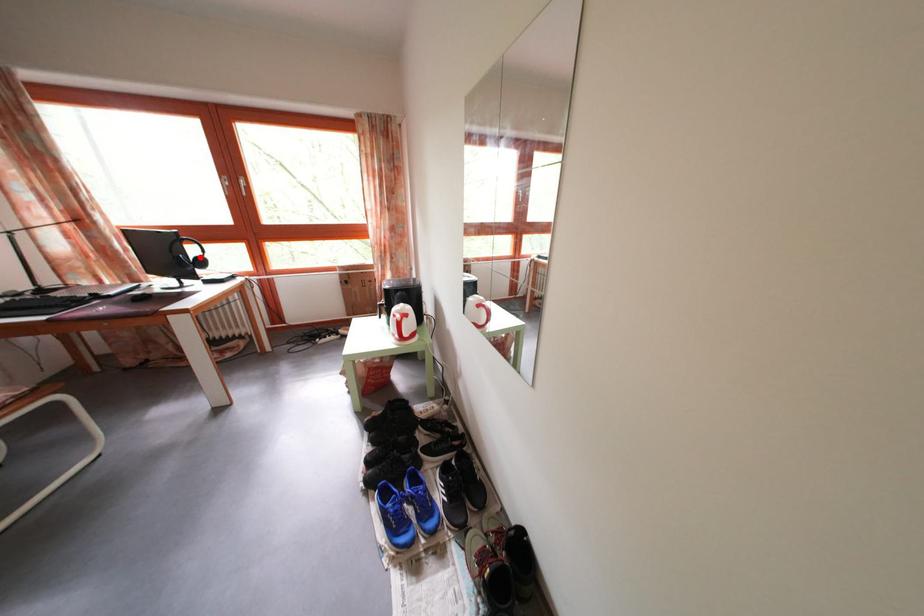
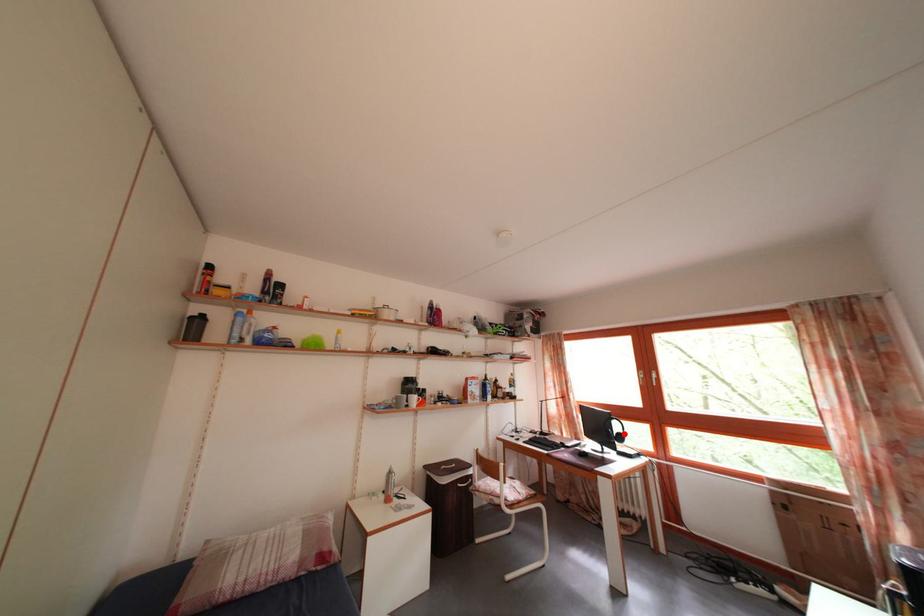
I am providing you with two images of the same scene from different viewpoints. A red point is marked on the first image and another point is marked on the second image. Do the highlighted points in image1 and image2 indicate the same real-world spot?

Yes